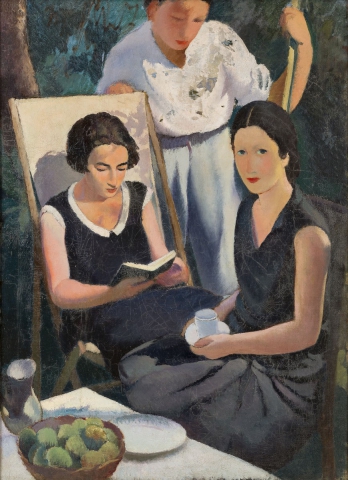
Where is `table, white`? This screenshot has height=480, width=348. table, white is located at coordinates (173, 465).